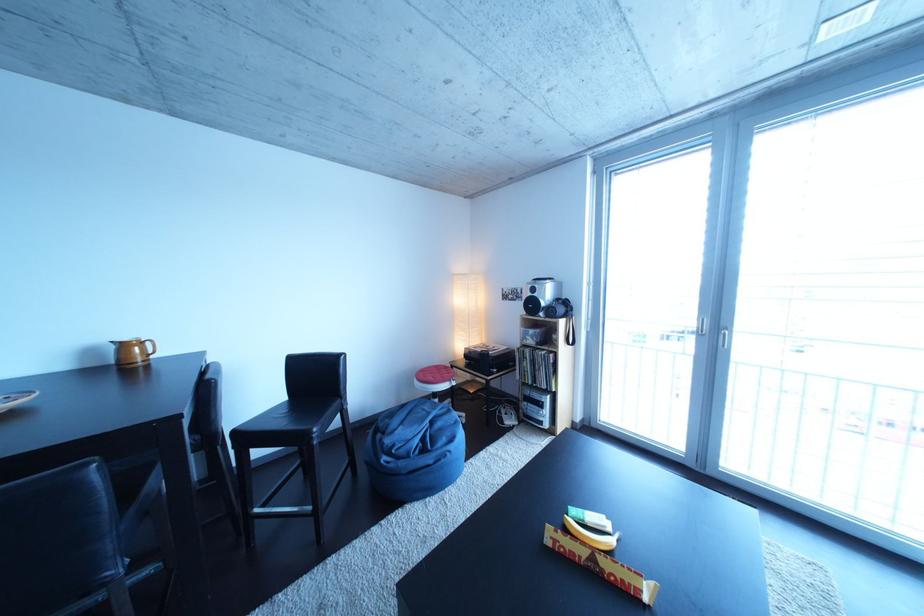
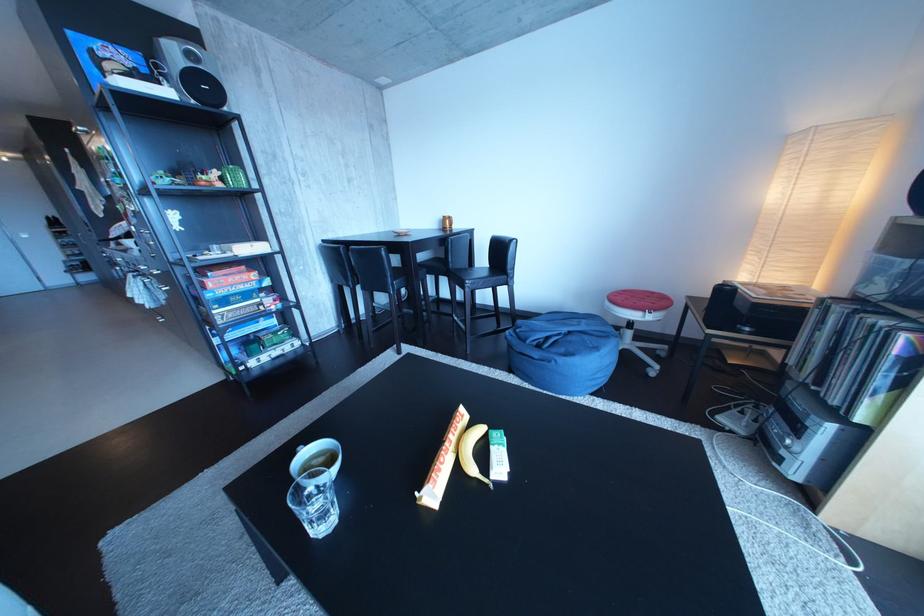
Locate, in the second image, the point that corresponds to (x=444, y=428) in the first image.

(582, 339)